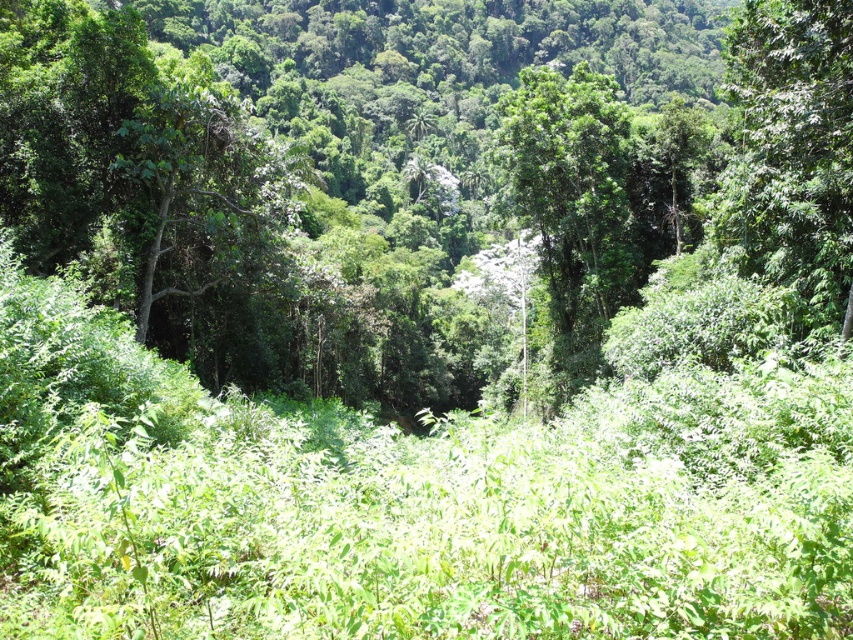
Question: Among these points, which one is farthest from the camera?

Choices:
 (A) (773, 228)
 (B) (592, 184)

Answer: (B)

Question: Can you confirm if green leafy tree at upper right is positioned above green leafy tree at center?

Choices:
 (A) yes
 (B) no

Answer: (A)

Question: Considering the relative positions of green leafy tree at upper right and green leafy tree at center in the image provided, where is green leafy tree at upper right located with respect to green leafy tree at center?

Choices:
 (A) below
 (B) above

Answer: (B)

Question: Observing the image, what is the correct spatial positioning of green leafy tree at upper right in reference to green leafy tree at center?

Choices:
 (A) left
 (B) right

Answer: (B)